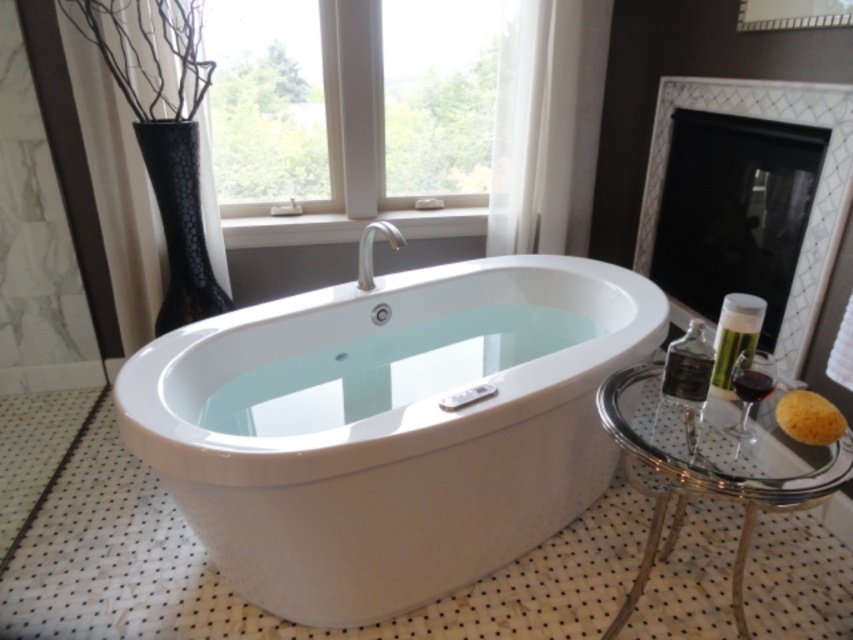
Can you confirm if white glossy bathtub at center is bigger than transparent glass window at upper center?

Yes, white glossy bathtub at center is bigger than transparent glass window at upper center.

Does white glossy bathtub at center have a lesser width compared to transparent glass window at upper center?

In fact, white glossy bathtub at center might be wider than transparent glass window at upper center.

You are a GUI agent. You are given a task and a screenshot of the screen. Output one action in this format:
    pyautogui.click(x=<x>, y=<y>)
    Task: Click on the white glossy bathtub at center
    
    Given the screenshot: What is the action you would take?
    pyautogui.click(x=389, y=426)

Is transparent glass window at upper center wider than clear glass stool at lower right?

Indeed, transparent glass window at upper center has a greater width compared to clear glass stool at lower right.

Which is behind, point (467, 108) or point (642, 394)?

Point (467, 108)

Does point (281, 113) come closer to viewer compared to point (643, 433)?

No.

This screenshot has width=853, height=640. What are the coordinates of `transparent glass window at upper center` in the screenshot? It's located at (399, 120).

In the scene shown: Can you confirm if clear glass stool at lower right is positioned to the right of white textured fireplace at right?

Incorrect, clear glass stool at lower right is not on the right side of white textured fireplace at right.

Which is behind, point (735, 460) or point (666, 77)?

The point (666, 77) is behind.

Where is `clear glass stool at lower right`? clear glass stool at lower right is located at coordinates (711, 470).